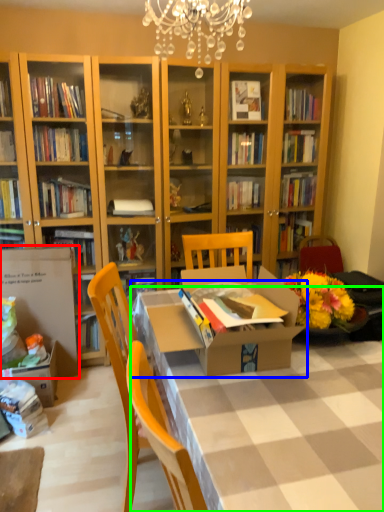
Question: Considering the real-world distances, which object is farthest from cardboard box (highlighted by a red box)? table (highlighted by a blue box) or desk (highlighted by a green box)?

Choices:
 (A) table
 (B) desk

Answer: (B)